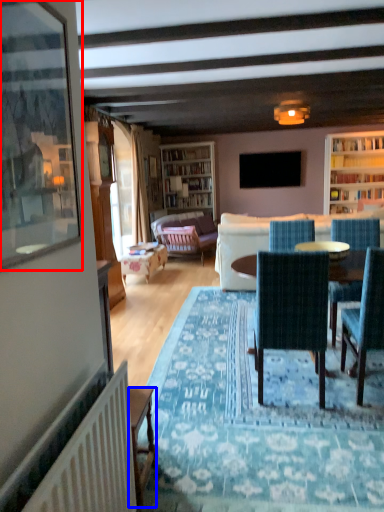
Question: Which object appears farthest to the camera in this image, picture frame (highlighted by a red box) or desk (highlighted by a blue box)?

Choices:
 (A) picture frame
 (B) desk

Answer: (B)